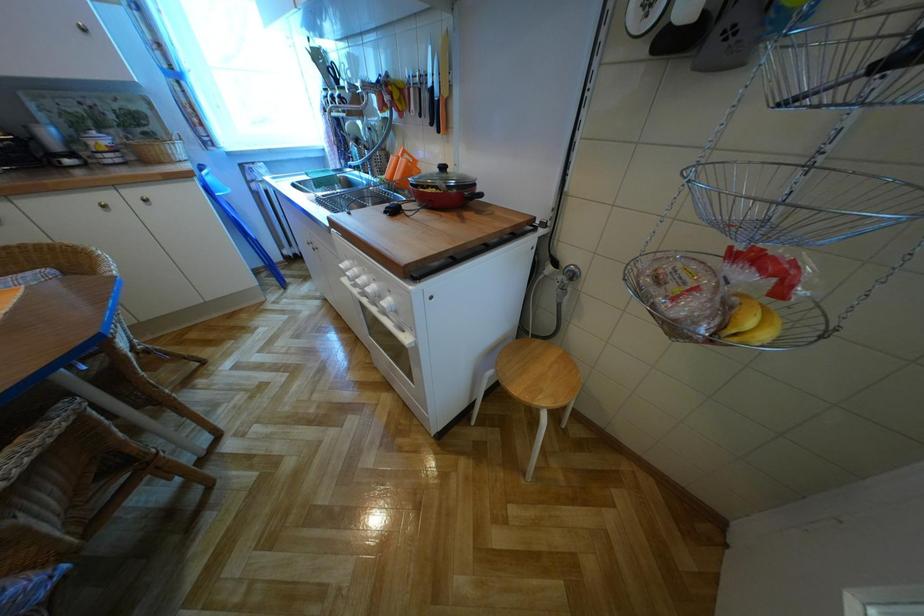
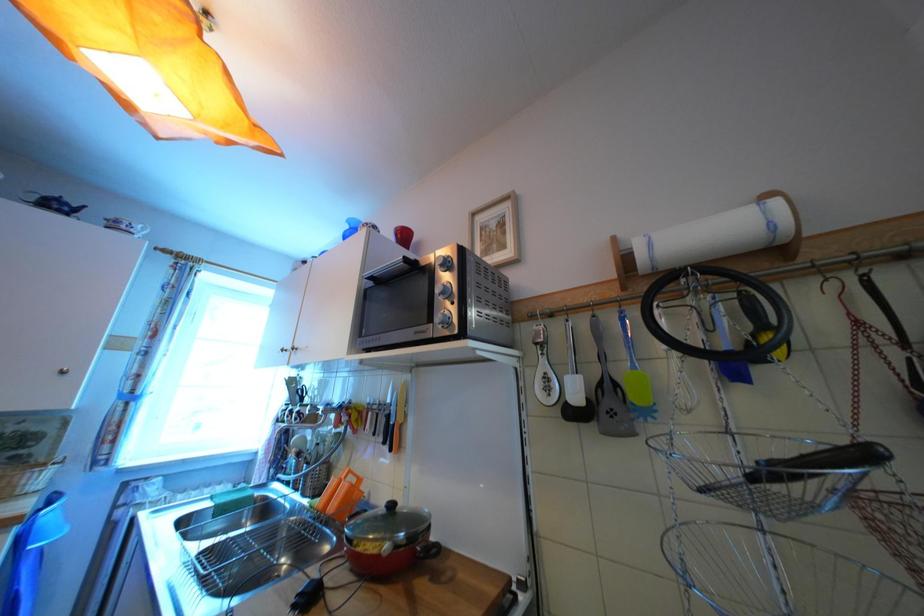
The first image is from the beginning of the video and the second image is from the end. How did the camera likely rotate when shooting the video?

The camera rotated toward right-up.